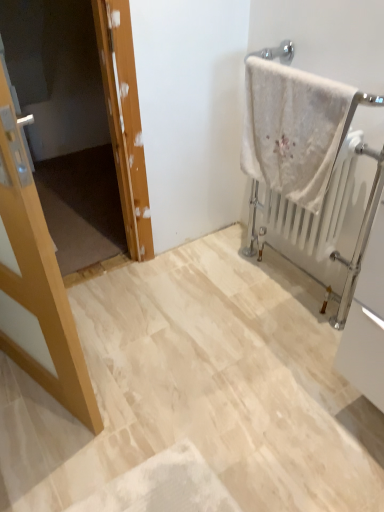
The width and height of the screenshot is (384, 512). I want to click on vacant area situated below white metallic radiator at right (from a real-world perspective), so click(x=284, y=280).